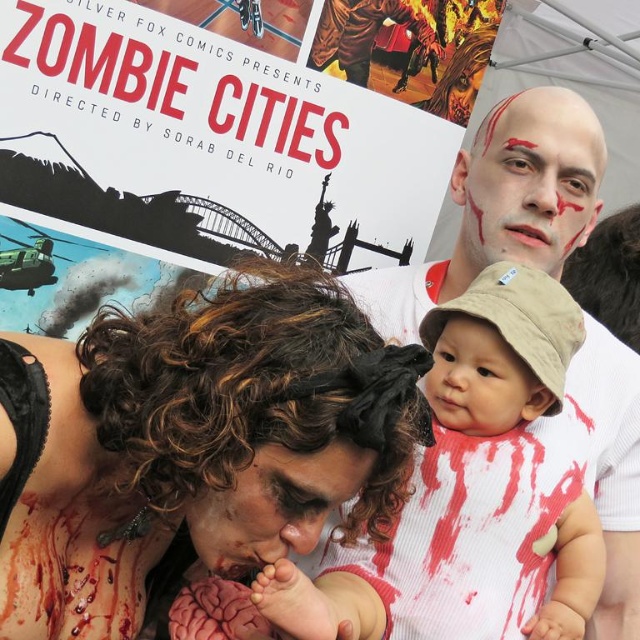
Question: Based on their relative distances, which object is farther from the curly hair at center?

Choices:
 (A) matte black face at center
 (B) white ribbed onesie at center
 (C) smooth beige hat at center
 (D) pale matte face at upper center

Answer: (D)

Question: Is matte black face at center bigger than smooth beige hat at center?

Choices:
 (A) yes
 (B) no

Answer: (A)

Question: Which point is closer to the camera?

Choices:
 (A) (67, 472)
 (B) (497, 164)
 (C) (300, 525)

Answer: (C)

Question: Can you confirm if matte black face at center is positioned above smooth beige hat at center?

Choices:
 (A) yes
 (B) no

Answer: (B)

Question: In this image, where is white ribbed onesie at center located relative to pale matte face at upper center?

Choices:
 (A) below
 (B) above

Answer: (A)

Question: Considering the real-world distances, which object is closest to the pale matte face at upper center?

Choices:
 (A) matte black face at center
 (B) curly hair at center
 (C) smooth beige hat at center
 (D) white ribbed onesie at center

Answer: (D)